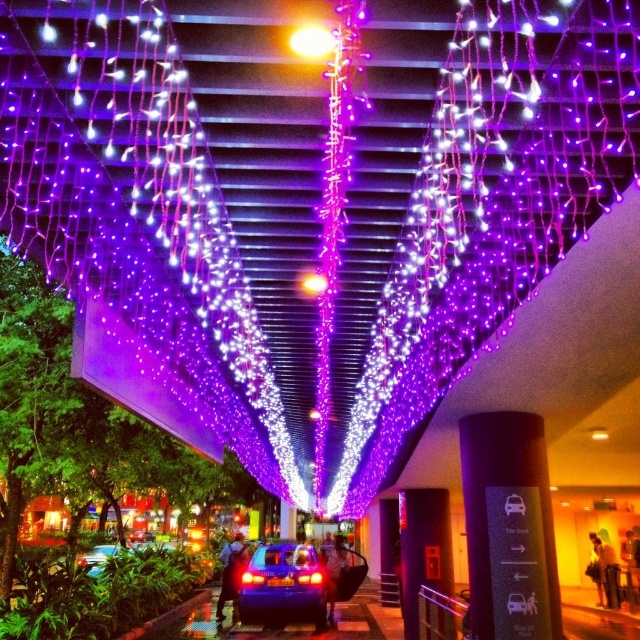
Question: Which object is closer to the camera taking this photo?

Choices:
 (A) metallic blue car at center
 (B) shiny blue car at center

Answer: (A)

Question: Is shiny blue car at center thinner than metallic blue car at center?

Choices:
 (A) yes
 (B) no

Answer: (A)

Question: Considering the relative positions of shiny blue car at center and metallic blue car at center in the image provided, where is shiny blue car at center located with respect to metallic blue car at center?

Choices:
 (A) left
 (B) right

Answer: (B)

Question: Which point is farther to the camera?

Choices:
 (A) (266, 588)
 (B) (113, 545)

Answer: (B)

Question: Can you confirm if shiny blue car at center is positioned to the left of metallic blue car at center?

Choices:
 (A) yes
 (B) no

Answer: (B)